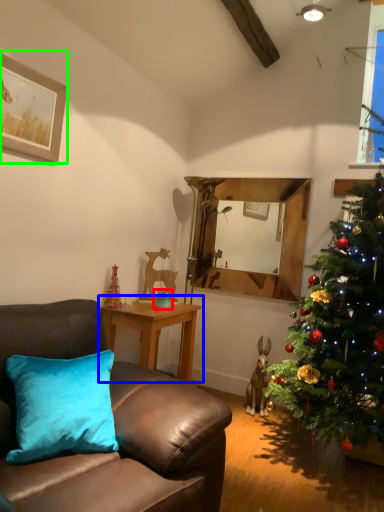
Question: Which is nearer to the teal (highlighted by a red box)? table (highlighted by a blue box) or picture frame (highlighted by a green box).

Choices:
 (A) table
 (B) picture frame

Answer: (A)